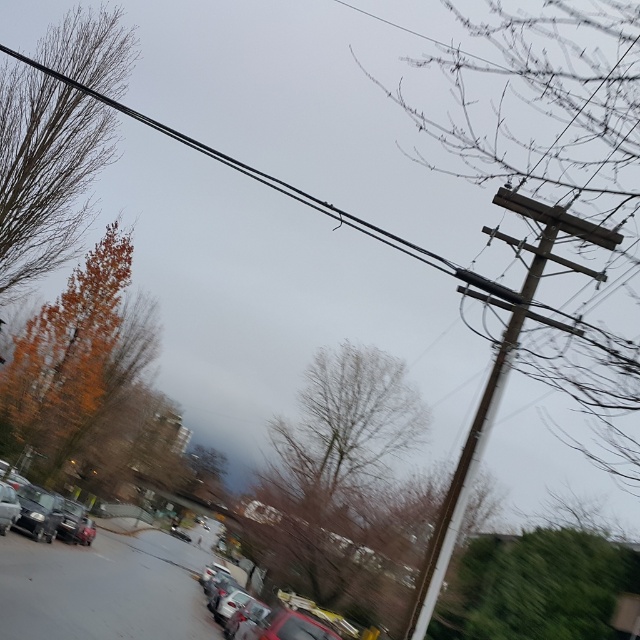
Question: Which object appears closest to the camera in this image?

Choices:
 (A) bare wood pole at upper right
 (B) metallic red car at center

Answer: (A)

Question: Which object is closer to the camera taking this photo?

Choices:
 (A) bare wood pole at upper right
 (B) black wire at upper center
 (C) brown wooden telegraph pole at right

Answer: (B)

Question: Does bare wood pole at upper right have a lesser width compared to orange leafy tree at left?

Choices:
 (A) no
 (B) yes

Answer: (A)

Question: Which point is farther from the camera taking this photo?

Choices:
 (A) (323, 428)
 (B) (1, 266)
 (C) (4, 45)
 (D) (410, 637)

Answer: (A)

Question: Is brown wooden telegraph pole at right bigger than metallic red car at center?

Choices:
 (A) no
 (B) yes

Answer: (A)

Question: Is the position of bare branches at center less distant than that of orange leafy tree at left?

Choices:
 (A) no
 (B) yes

Answer: (B)